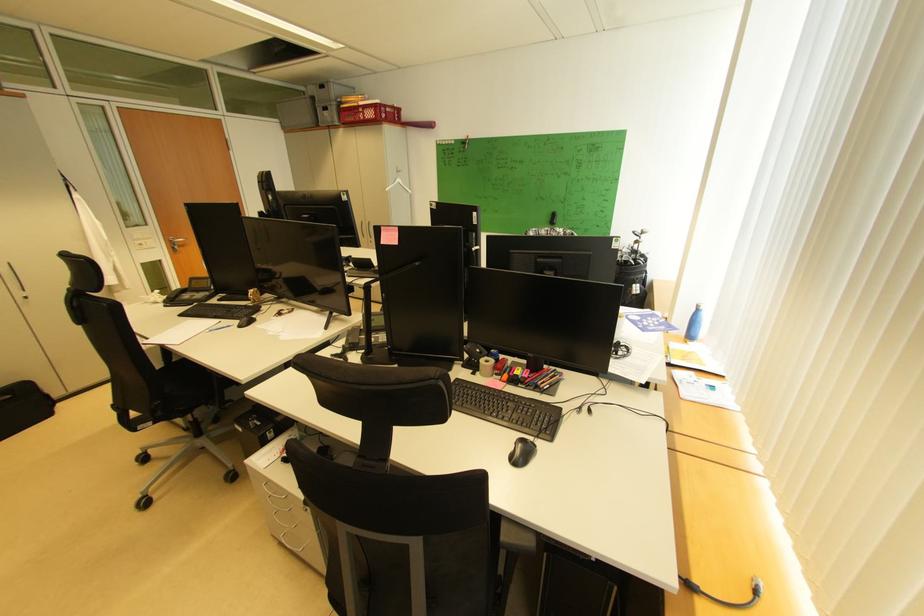
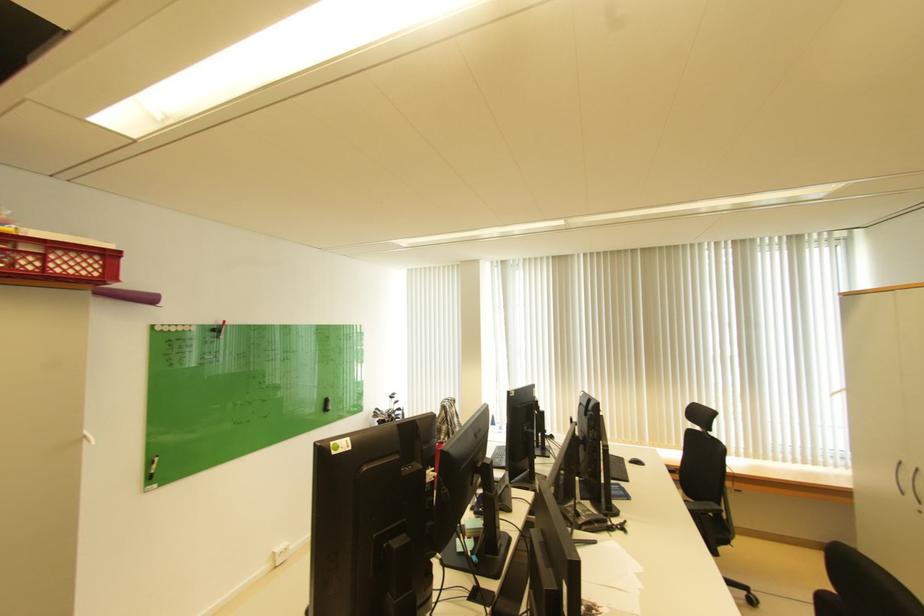
Locate, in the second image, the point that corresponds to point 439,127 in the first image.

(160, 301)